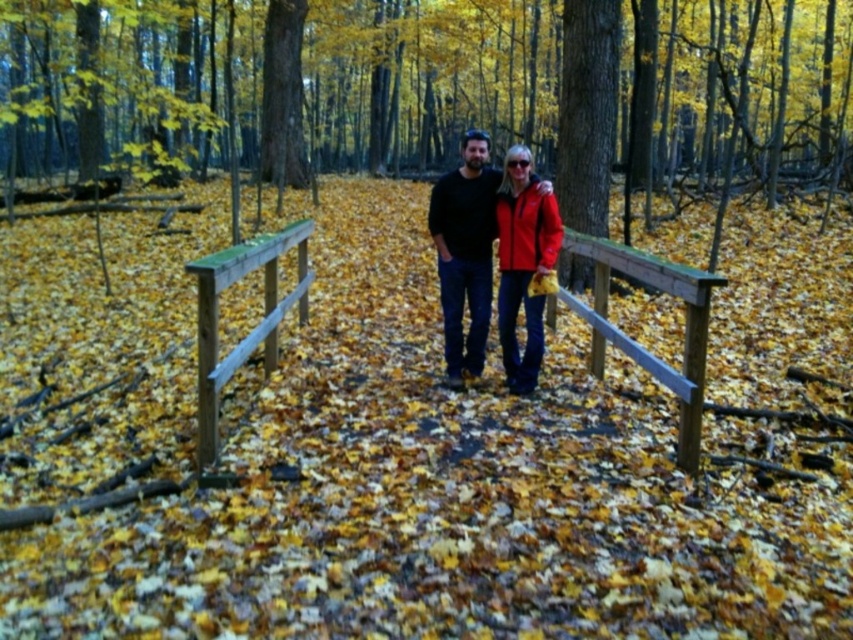
You are a photographer planning to capture a portrait of the couple on the wooden bridge. You want to ensure the matte black shirt at center is visible above the wooden rail at center. Based on the scene, is this possible?

The matte black shirt at center is located below the wooden rail at center, so it would not be visible above the rail in the portrait.

You are standing on the wooden bridge in the autumn forest scene. There are two points marked on the bridge. The first point is at coordinates point (x=466, y=224) and the second point is at point (x=296, y=234). Which point is closer to you?

Point (x=466, y=224) is closer to the viewer than point (x=296, y=234).

You are a hiker walking along the wooden rail at center and looking towards the smooth brown bark at upper center. Which object is closer to you?

The smooth brown bark at upper center is closer to you because it is positioned further to the viewer than the wooden rail at center, meaning it appears nearer in your line of sight.